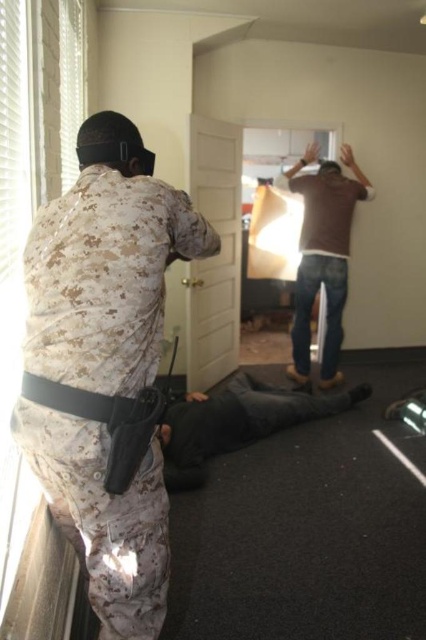
Is brown matte shirt at upper center wider than camouflage fabric uniform at center?

In fact, brown matte shirt at upper center might be narrower than camouflage fabric uniform at center.

This screenshot has width=426, height=640. What do you see at coordinates (322, 259) in the screenshot?
I see `brown matte shirt at upper center` at bounding box center [322, 259].

The width and height of the screenshot is (426, 640). What do you see at coordinates (322, 259) in the screenshot? I see `brown matte shirt at upper center` at bounding box center [322, 259].

Where is `brown matte shirt at upper center`? brown matte shirt at upper center is located at coordinates (322, 259).

The height and width of the screenshot is (640, 426). Identify the location of camouflagetextured fabric at left. (106, 278).

Between point (123, 627) and point (77, 17), which one is positioned behind?

The point (77, 17) is more distant.

This screenshot has width=426, height=640. Find the location of `camouflagetextured fabric at left`. camouflagetextured fabric at left is located at coordinates (106, 278).

Looking at this image, who is shorter, camouflagetextured fabric at left or black matte holster at lower left?

Standing shorter between the two is black matte holster at lower left.

Is camouflagetextured fabric at left closer to camera compared to black matte holster at lower left?

Yes.

Is point (71, 244) less distant than point (161, 406)?

Yes, point (71, 244) is closer to viewer.

I want to click on camouflagetextured fabric at left, so click(x=106, y=278).